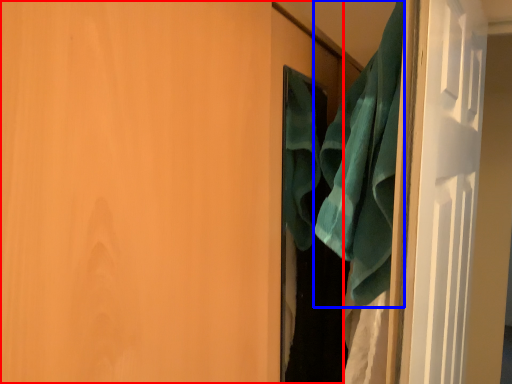
Question: Among these objects, which one is nearest to the camera, door (highlighted by a red box) or beach towel (highlighted by a blue box)?

Choices:
 (A) door
 (B) beach towel

Answer: (A)